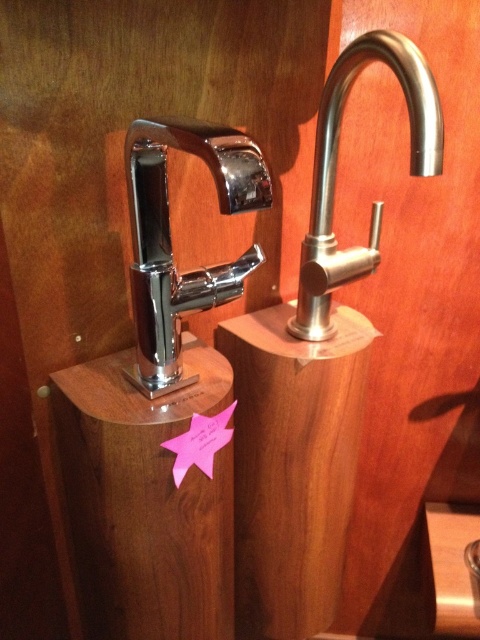
You are a customer in a showroom and want to know which faucet is taller. You see the polished chrome faucet at center and the polished stainless steel faucet at upper right. Which one is taller?

The polished stainless steel faucet at upper right is taller than the polished chrome faucet at center.

You are standing in front of the two faucets displayed on wooden pedestals. Which faucet is positioned closer to the wooden pedestal at center?

The wooden pedestal at center is located at point (145, 500), so the faucet on the right is closer to the wooden pedestal at center than the one on the left.

You are standing in a showroom and want to touch the point at coordinates point [134,618]. If your hand can reach up to 80 centimeters, will you be able to reach it?

The distance of point [134,618] from the camera is 82.75 centimeters, so your hand cannot reach it since it is beyond the 80 centimeter limit.